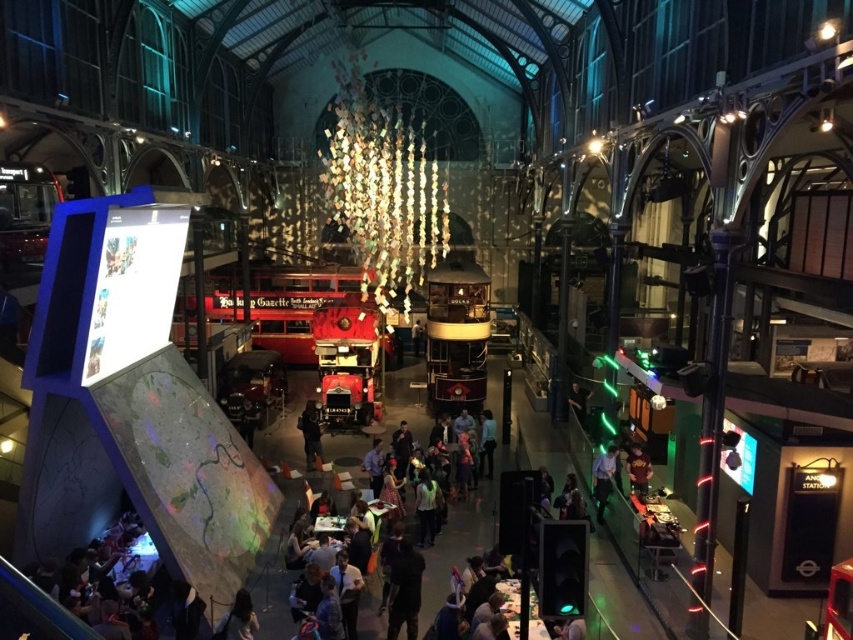
You are standing at the entrance of the grand hall and want to walk towards the vintage vehicles in the center. There are two points marked on the floor at coordinates point (601, 461) and point (483, 461). Which of these points is closer to the entrance?

Point (483, 461) is closer to the entrance because it is behind point (601, 461), which is in front of it.

You are a security guard in the museum. You notice two visitors wearing dark blue shirt at center and dark blue jeans at center. From your vantage point, which clothing item is closer to you?

The dark blue shirt at center is closer to you because it is in front of the dark blue jeans at center.